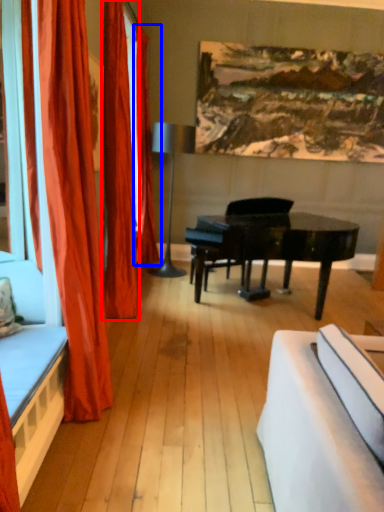
Question: Which object is further to the camera taking this photo, curtain (highlighted by a red box) or curtain (highlighted by a blue box)?

Choices:
 (A) curtain
 (B) curtain

Answer: (B)